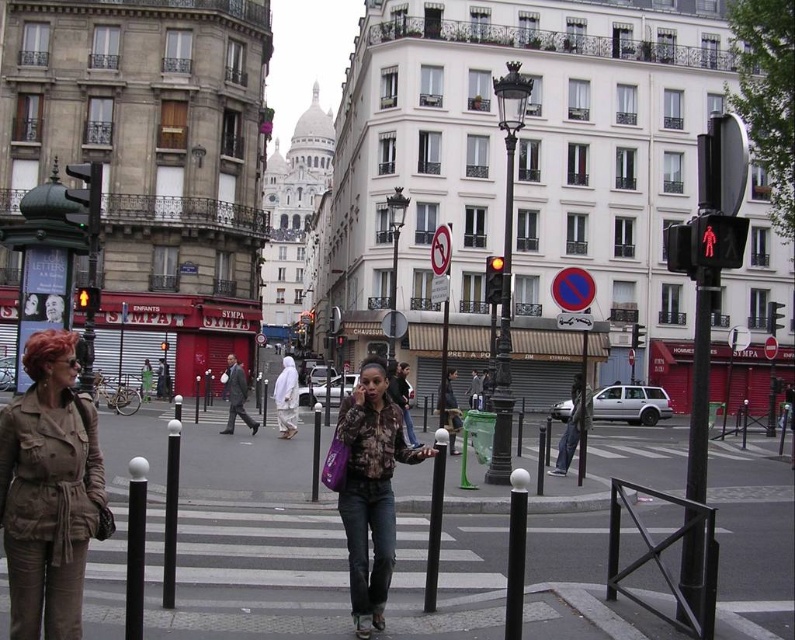
Consider the image. You are standing at the point marked by point (x=572, y=426). Can you see the Sacre Coeur Basilica in the background from this position?

Yes, the Sacre Coeur Basilica is visible in the background of the scene, so from the position marked by point (x=572, y=426), you can see it.

You are a delivery person trying to navigate through the street. You need to know which traffic control device is narrower between the red plastic pedestrian signal at right and the yellow glass traffic light at center. Which one is narrower?

The red plastic pedestrian signal at right has a lesser width compared to the yellow glass traffic light at center, so the red plastic pedestrian signal at right is narrower.